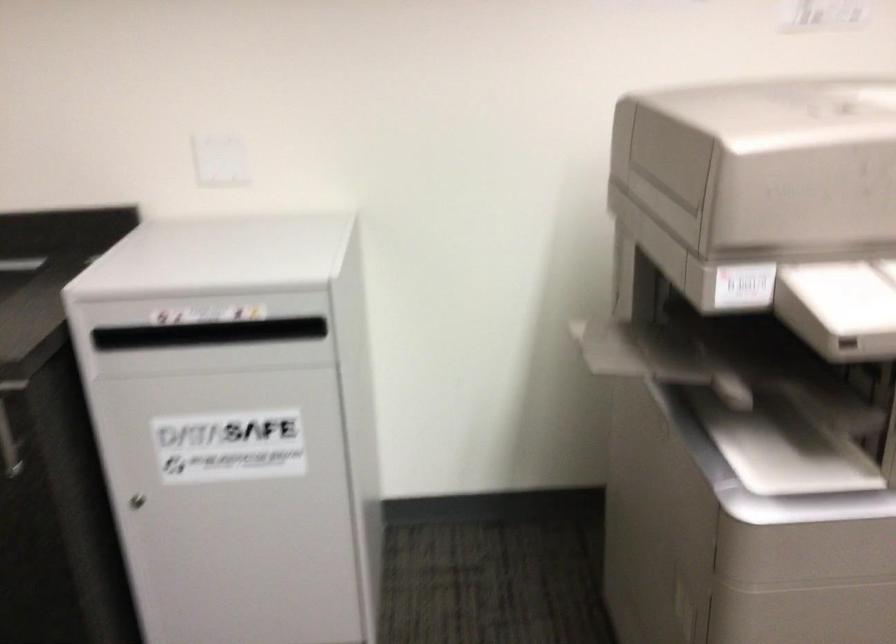
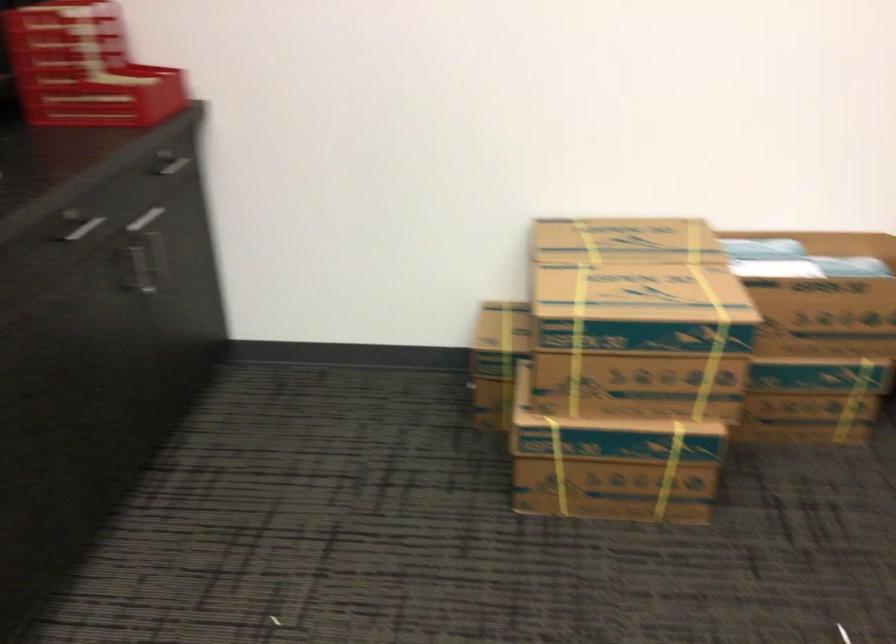
First-person continuous shooting, in which direction is the camera rotating?

The camera rotated toward left-down.